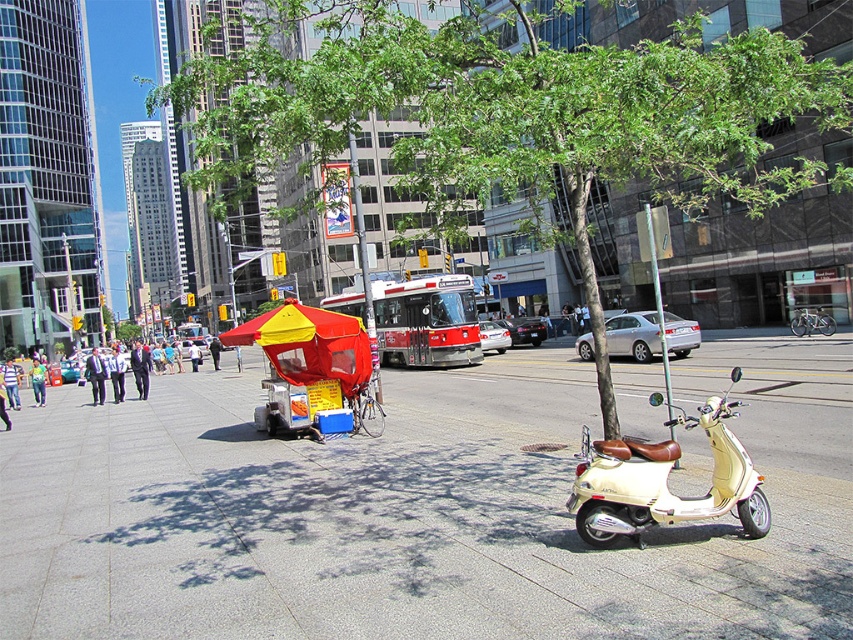
Between smooth concrete sidewalk at center and beige matte scooter at lower right, which one has more height?

Standing taller between the two is smooth concrete sidewalk at center.

Is point (801, 529) positioned behind point (616, 492)?

Yes, point (801, 529) is farther from viewer.

Who is more forward, (218, 413) or (653, 520)?

Point (653, 520) is in front.

Locate an element on the screen. smooth concrete sidewalk at center is located at coordinates (416, 509).

Is green leafy tree at center to the left of red fabric umbrella at center from the viewer's perspective?

Indeed, green leafy tree at center is positioned on the left side of red fabric umbrella at center.

Is point (799, 42) positioned after point (421, 339)?

No, it is in front of (421, 339).

In order to click on green leafy tree at center in this screenshot , I will do `click(511, 112)`.

Can you confirm if green leafy tree at center is taller than beige matte scooter at lower right?

Yes, green leafy tree at center is taller than beige matte scooter at lower right.

Is point (761, 150) closer to camera compared to point (660, 486)?

No, (761, 150) is further to viewer.

Between point (263, 104) and point (602, 520), which one is positioned behind?

Positioned behind is point (602, 520).

I want to click on green leafy tree at center, so click(511, 112).